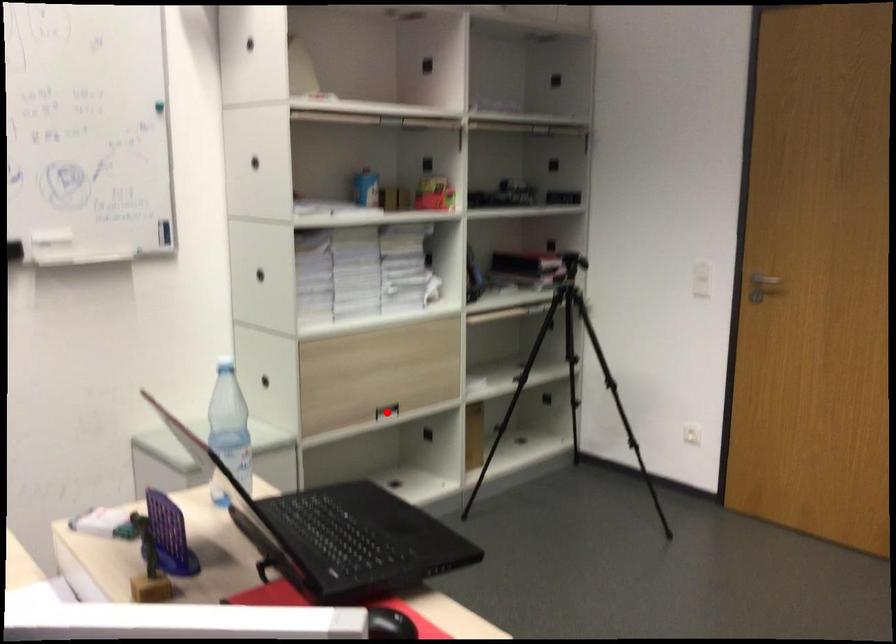
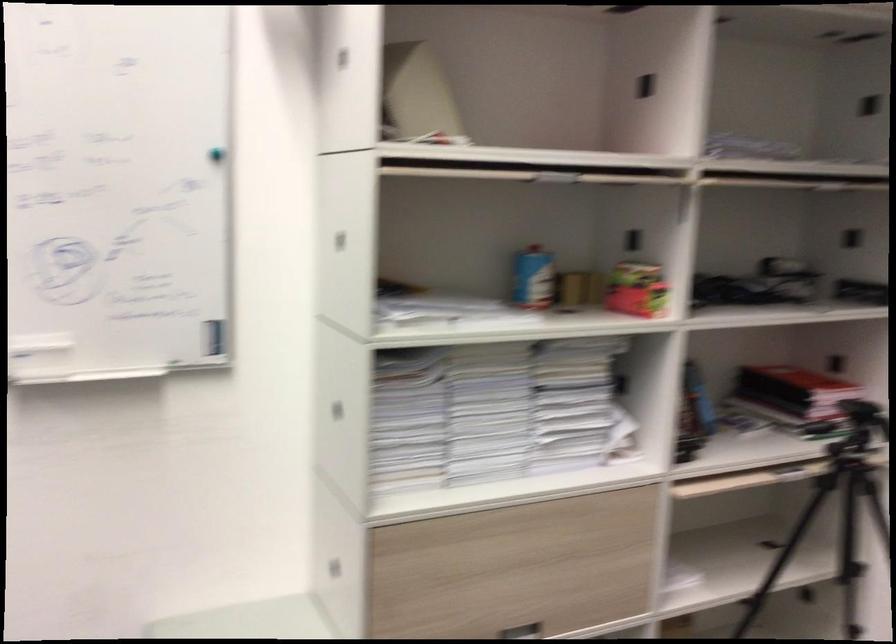
Locate, in the second image, the point that corresponds to the highlighted location in the first image.

(522, 630)